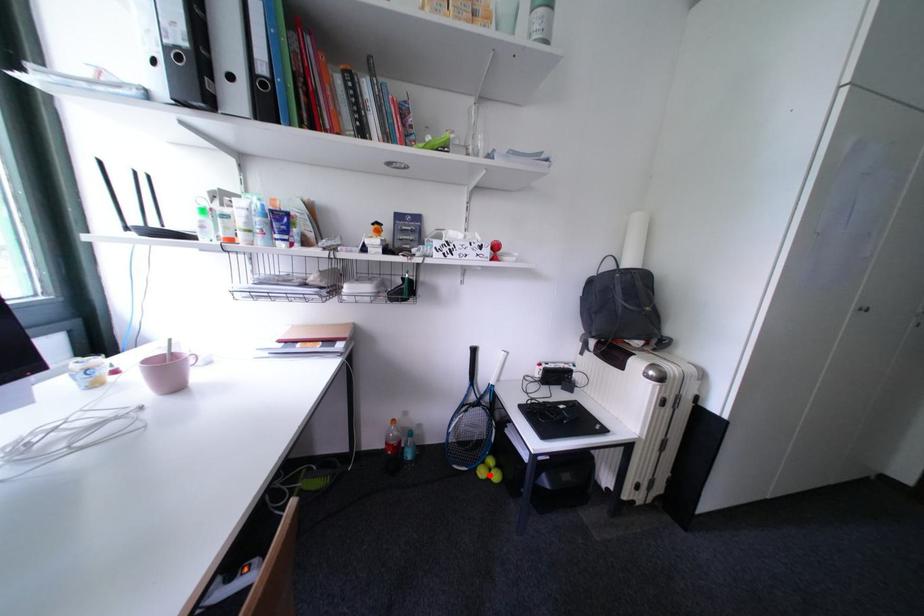
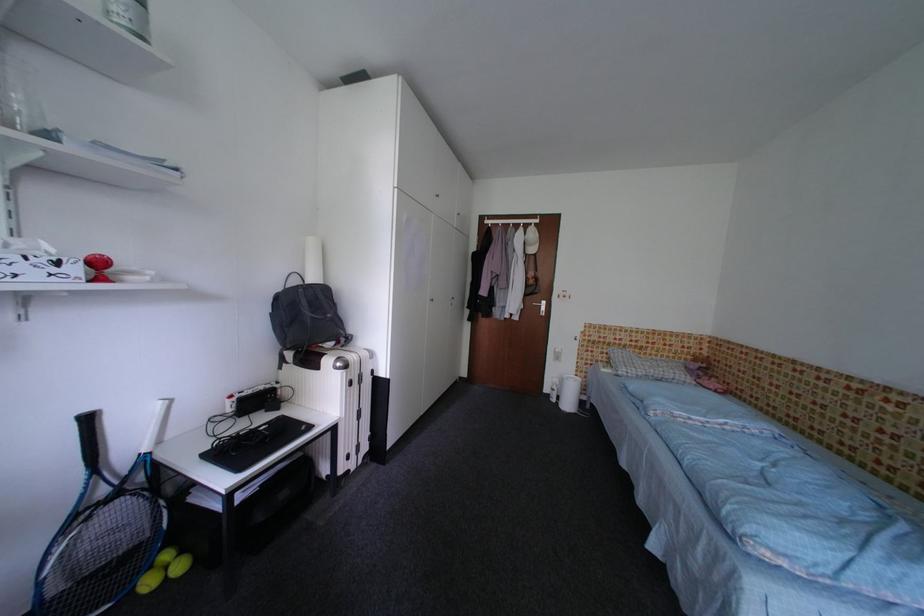
Question: I am providing you with two images of the same scene from different viewpoints. In image1, a red point is highlighted. Considering the same 3D point in image2, which of the following is correct?

Choices:
 (A) It is closer
 (B) It is farther

Answer: (A)